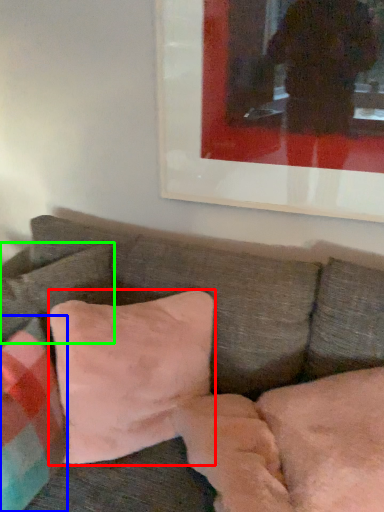
Question: Which object is the farthest from pillow (highlighted by a red box)? Choose among these: pillow (highlighted by a blue box) or pillow (highlighted by a green box).

Choices:
 (A) pillow
 (B) pillow

Answer: (B)